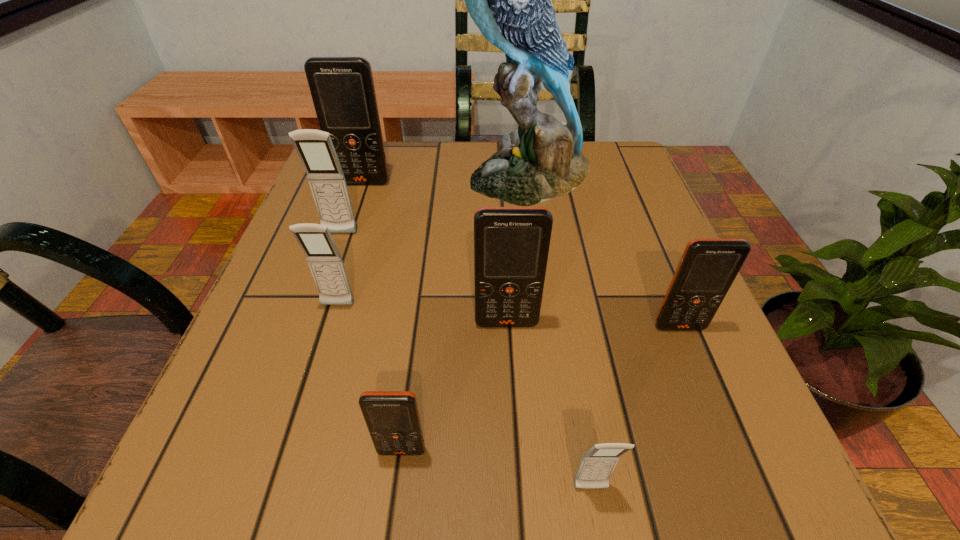
Identify which gray cellular telephone is the second closest to the second nearest gray cellular telephone. Please provide its 2D coordinates. Your answer should be formatted as a tuple, i.e. [(x, y)], where the tuple contains the x and y coordinates of a point satisfying the conditions above.

[(597, 464)]

Image resolution: width=960 pixels, height=540 pixels. I want to click on gray cellular telephone that is the second closest one to the biggest gray cellular telephone, so click(x=597, y=464).